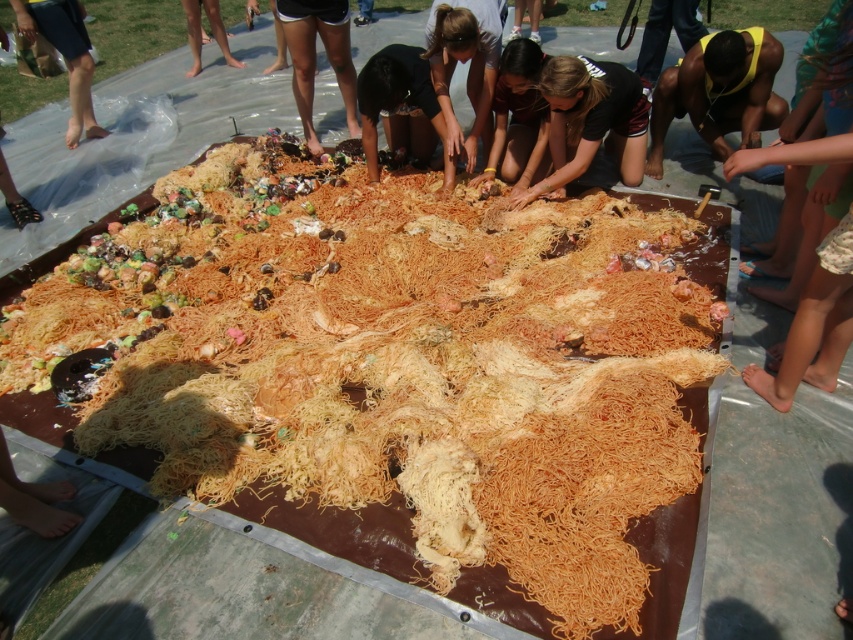
Describe the element at coordinates (314, 56) in the screenshot. This screenshot has width=853, height=640. I see `smooth tan skin at center` at that location.

Is the position of smooth tan skin at center less distant than that of brown skin at lower left?

That is True.

Where is `smooth tan skin at center`? This screenshot has width=853, height=640. smooth tan skin at center is located at coordinates (314, 56).

Can you confirm if smooth brown hair at center is wider than brown fabric bag at upper left?

Yes, smooth brown hair at center is wider than brown fabric bag at upper left.

In the scene shown: Who is higher up, smooth brown hair at center or brown fabric bag at upper left?

Positioned higher is brown fabric bag at upper left.

Is point (596, 72) less distant than point (71, 10)?

That is True.

Identify the location of smooth brown hair at center. (590, 120).

Can you confirm if brown fabric bag at upper left is positioned below brown skin at lower left?

Correct, brown fabric bag at upper left is located below brown skin at lower left.

You are a GUI agent. You are given a task and a screenshot of the screen. Output one action in this format:
    pyautogui.click(x=<x>, y=<y>)
    Task: Click on the brown fabric bag at upper left
    This screenshot has width=853, height=640.
    Given the screenshot: What is the action you would take?
    pyautogui.click(x=64, y=54)